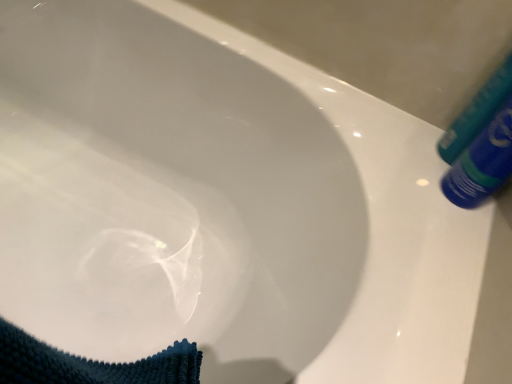
Question: Can you confirm if blue glossy tube at upper right, acting as the 2th tube starting from the top, is shorter than blue plastic tube at upper right, placed as the 1th tube when sorted from top to bottom?

Choices:
 (A) yes
 (B) no

Answer: (A)

Question: Is blue glossy tube at upper right, acting as the 2th tube starting from the top, wider than blue plastic tube at upper right, placed as the 1th tube when sorted from top to bottom?

Choices:
 (A) no
 (B) yes

Answer: (B)

Question: From the image's perspective, would you say blue glossy tube at upper right, which appears as the first tube when ordered from the bottom, is shown under blue plastic tube at upper right, placed as the 1th tube when sorted from top to bottom?

Choices:
 (A) yes
 (B) no

Answer: (A)

Question: Is blue plastic tube at upper right, the 2th tube positioned from the bottom, at the back of blue glossy tube at upper right, acting as the 2th tube starting from the top?

Choices:
 (A) yes
 (B) no

Answer: (A)

Question: Would you consider blue glossy tube at upper right, acting as the 2th tube starting from the top, to be distant from blue plastic tube at upper right, the 2th tube positioned from the bottom?

Choices:
 (A) no
 (B) yes

Answer: (A)

Question: Does blue glossy tube at upper right, acting as the 2th tube starting from the top, come behind blue plastic tube at upper right, placed as the 1th tube when sorted from top to bottom?

Choices:
 (A) yes
 (B) no

Answer: (B)

Question: Is blue plastic tube at upper right, the 2th tube positioned from the bottom, further to the viewer compared to blue glossy tube at upper right, acting as the 2th tube starting from the top?

Choices:
 (A) no
 (B) yes

Answer: (B)

Question: Is blue plastic tube at upper right, placed as the 1th tube when sorted from top to bottom, to the right of blue glossy tube at upper right, which appears as the first tube when ordered from the bottom, from the viewer's perspective?

Choices:
 (A) no
 (B) yes

Answer: (B)

Question: Is blue plastic tube at upper right, placed as the 1th tube when sorted from top to bottom, positioned with its back to blue glossy tube at upper right, acting as the 2th tube starting from the top?

Choices:
 (A) yes
 (B) no

Answer: (A)

Question: Can you confirm if blue plastic tube at upper right, the 2th tube positioned from the bottom, is wider than blue glossy tube at upper right, which appears as the first tube when ordered from the bottom?

Choices:
 (A) no
 (B) yes

Answer: (A)

Question: Considering the relative sizes of blue plastic tube at upper right, placed as the 1th tube when sorted from top to bottom, and blue glossy tube at upper right, which appears as the first tube when ordered from the bottom, in the image provided, is blue plastic tube at upper right, placed as the 1th tube when sorted from top to bottom, thinner than blue glossy tube at upper right, which appears as the first tube when ordered from the bottom,?

Choices:
 (A) no
 (B) yes

Answer: (B)

Question: Is blue plastic tube at upper right, placed as the 1th tube when sorted from top to bottom, far away from blue glossy tube at upper right, which appears as the first tube when ordered from the bottom?

Choices:
 (A) yes
 (B) no

Answer: (B)

Question: From their relative heights in the image, would you say blue plastic tube at upper right, the 2th tube positioned from the bottom, is taller or shorter than blue glossy tube at upper right, acting as the 2th tube starting from the top?

Choices:
 (A) tall
 (B) short

Answer: (A)